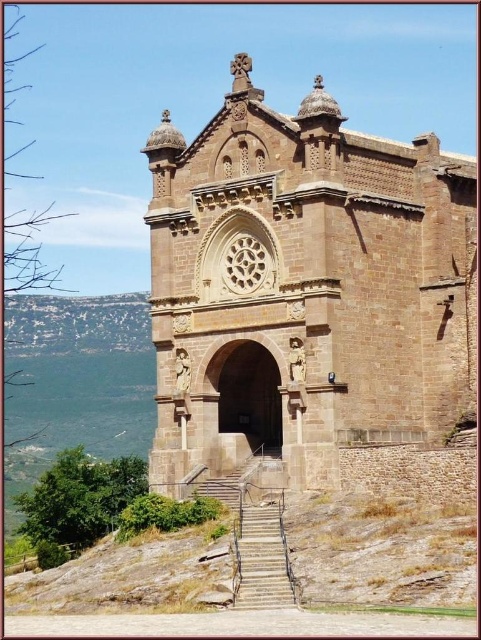
Which is below, brown stone church at center or stone textured stairs at center?

stone textured stairs at center is below.

Describe the element at coordinates (308, 298) in the screenshot. I see `brown stone church at center` at that location.

Where is `brown stone church at center`? The image size is (481, 640). brown stone church at center is located at coordinates (308, 298).